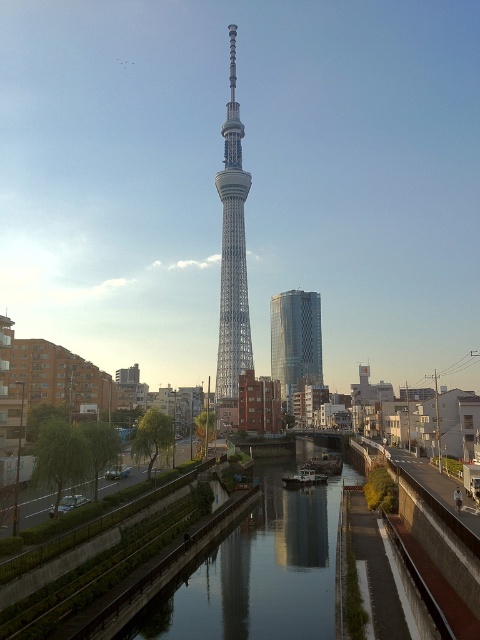
You are standing at point (x=260, y=570) in the image. What is located at this point?

At point (x=260, y=570) lies smooth concrete canal at center.

You are standing at the center of the image and want to find the smooth concrete canal at center. According to the coordinates provided, in which direction should you look to locate it?

The smooth concrete canal at center is located at coordinates point (260, 570), so you should look towards the lower right direction from the center to locate it.

You are a drone operator who needs to fly a drone between the smooth concrete canal at center and the shiny glass skyscraper at center. Which object should you avoid flying too close to due to height restrictions?

The smooth concrete canal at center has a lesser height compared to the shiny glass skyscraper at center, so you should avoid flying too close to the shiny glass skyscraper at center due to its greater height.